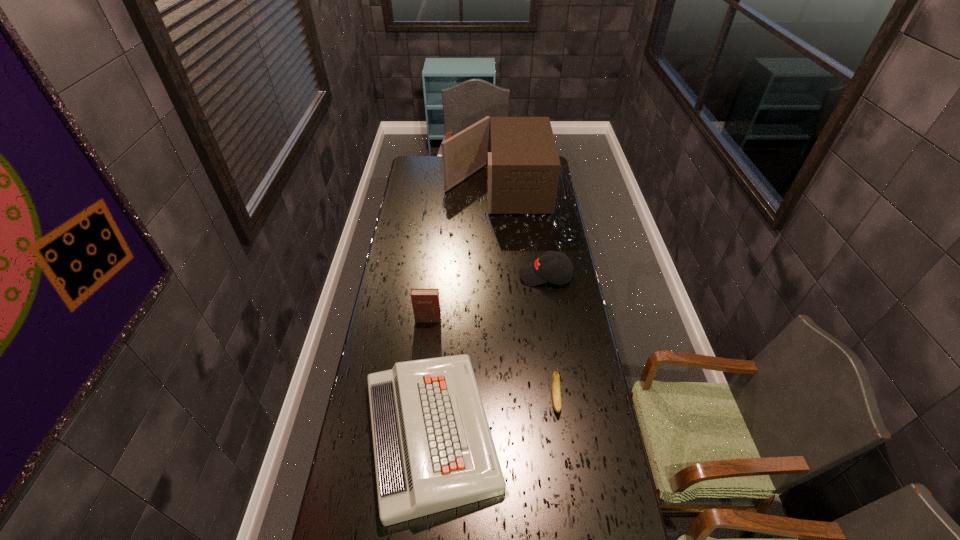
This screenshot has width=960, height=540. Identify the location of vacant space located on the front cover of the diary. (420, 390).

I want to click on vacant position located at the start of the peel on the banana, so coord(561,438).

Find the location of a particular element. Image resolution: width=960 pixels, height=540 pixels. free space located on the front-facing side of the fourth nearest object is located at coordinates (482, 276).

The width and height of the screenshot is (960, 540). I want to click on vacant space situated 0.390m on the front-facing side of the fourth nearest object, so click(x=429, y=276).

At what (x,y) coordinates should I click in order to perform the action: click on vacant space situated on the front-facing side of the fourth nearest object. Please return your answer as a coordinate pair (x, y). The image size is (960, 540). Looking at the image, I should click on (449, 276).

Locate an element on the screen. vacant point located on the right of the shortest object is located at coordinates (547, 433).

I want to click on object at the far edge, so click(523, 170).

Find the location of `diary that is at the left edge`. diary that is at the left edge is located at coordinates (426, 306).

Where is `computer keyboard that is at the left edge`? The width and height of the screenshot is (960, 540). computer keyboard that is at the left edge is located at coordinates tap(433, 449).

I want to click on microwave oven located in the right edge section of the desktop, so click(x=523, y=170).